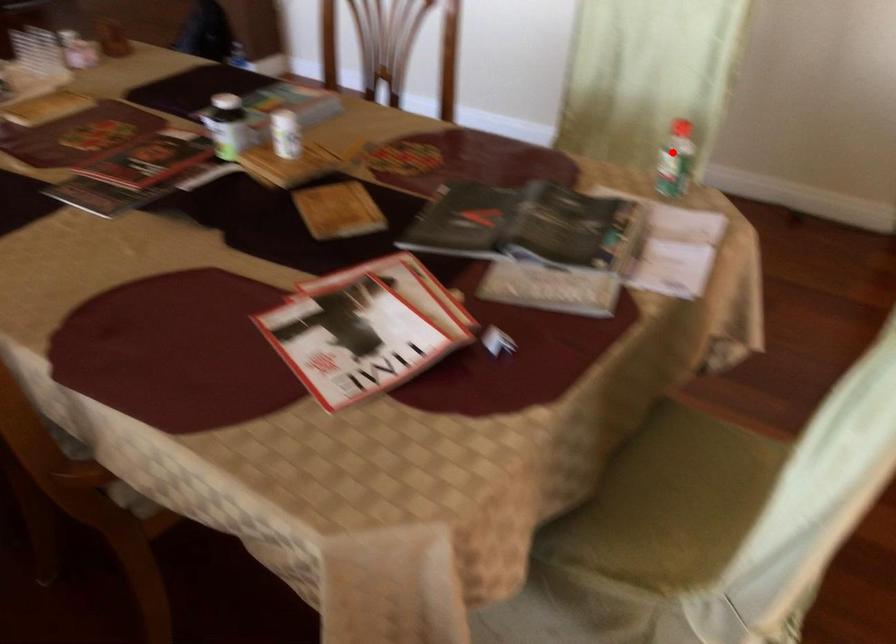
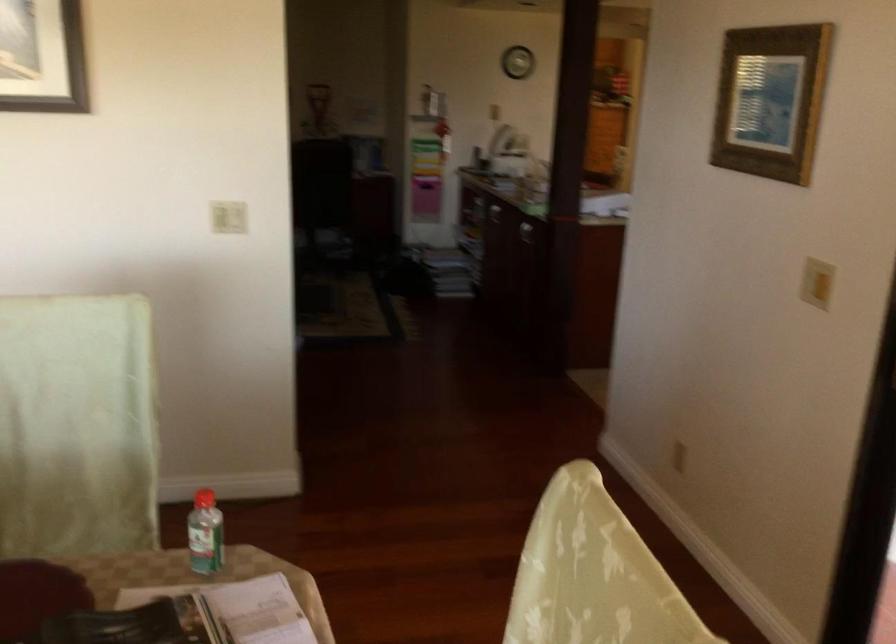
Where in the second image is the point corresponding to the highlighted location from the first image?

(204, 534)